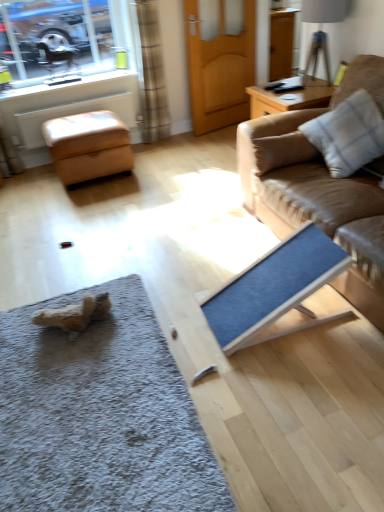
This screenshot has height=512, width=384. Identify the location of free space to the left of blue fabric yoga mat at center. (187, 309).